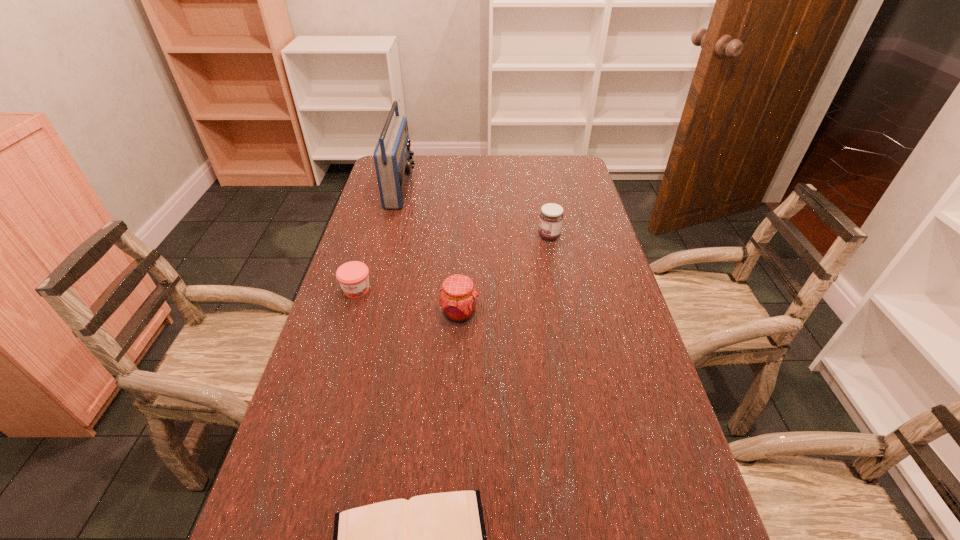
Where is `jam that can be found as the second closest to the fourth tallest object`? The image size is (960, 540). jam that can be found as the second closest to the fourth tallest object is located at coordinates (551, 216).

The height and width of the screenshot is (540, 960). In order to click on free space that satisfies the following two spatial constraints: 1. on the front panel of the tallest object; 2. on the front label of the second shortest object in this screenshot , I will do `click(374, 290)`.